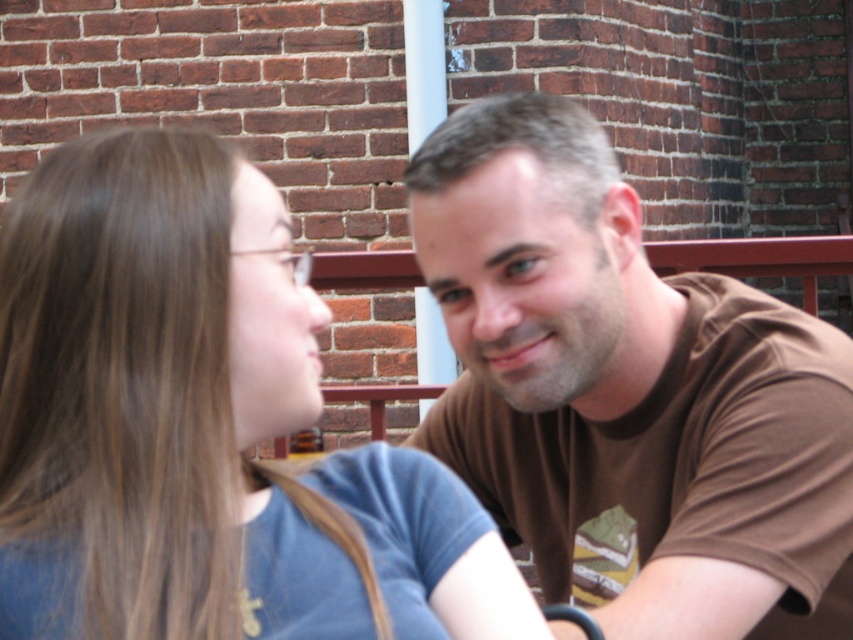
Which is below, brown cotton t-shirt at center or blue cotton shirt at center?

Positioned lower is blue cotton shirt at center.

Is point (621, 280) farther from viewer compared to point (83, 269)?

Yes, it is.

Locate an element on the screen. brown cotton t-shirt at center is located at coordinates (627, 392).